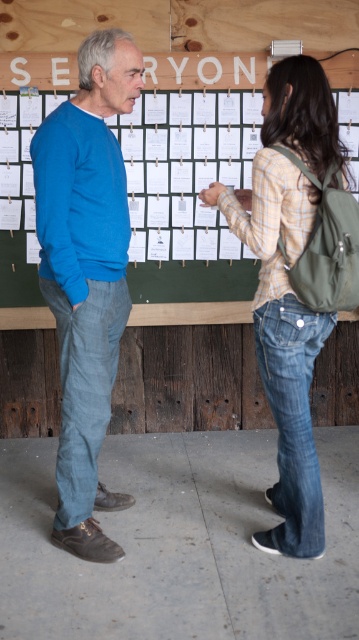
You are a tailor measuring two pairs of denim jeans in the scene. The denim jeans at center and the denim jeans at lower right. Which pair has a greater width?

The denim jeans at center has a greater width than the denim jeans at lower right according to the description.

You are a tailor measuring the distance between two pairs of denim jeans in the image. The scene shows two people standing in front of a wall with small white papers pinned to it. You need to determine if a 4.5 inch wide tailor board can fit between the denim jeans at center and denim jeans at lower right. Can it fit?

The distance between the denim jeans at center and denim jeans at lower right is 4.38 inches, which is slightly less than the 4.5 inch width of the tailor board. Therefore, the tailor board cannot fit between them.